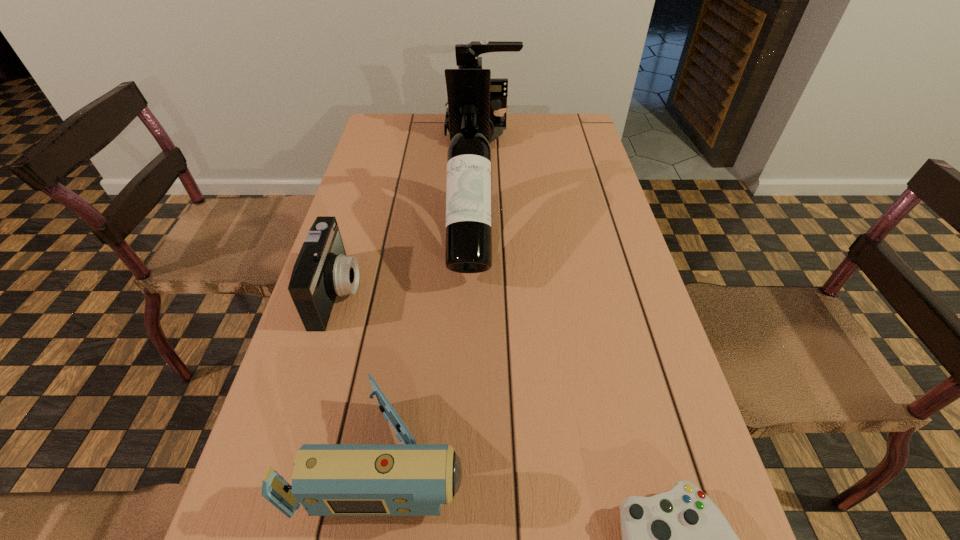
At what (x,y) coordinates should I click in order to perform the action: click on unoccupied area between the wine bottle and the second farthest camcorder. Please return your answer as a coordinate pair (x, y). This screenshot has width=960, height=540. Looking at the image, I should click on (404, 264).

What are the coordinates of `free spot between the nearest camcorder and the tallest object` in the screenshot? It's located at (428, 347).

Find the location of a particular element. The width and height of the screenshot is (960, 540). empty location between the nearest camcorder and the wine bottle is located at coordinates (428, 347).

The height and width of the screenshot is (540, 960). In order to click on blank region between the nearest camcorder and the second farthest camcorder in this screenshot , I will do `click(361, 375)`.

Select which object is the closest to the tallest camcorder. Please provide its 2D coordinates. Your answer should be formatted as a tuple, i.e. [(x, y)], where the tuple contains the x and y coordinates of a point satisfying the conditions above.

[(468, 242)]

I want to click on object that stands as the second closest to the second nearest camcorder, so click(x=468, y=242).

Select which camcorder appears as the third closest to the tallest object. Please provide its 2D coordinates. Your answer should be formatted as a tuple, i.e. [(x, y)], where the tuple contains the x and y coordinates of a point satisfying the conditions above.

[(409, 479)]

At what (x,y) coordinates should I click in order to perform the action: click on camcorder identified as the third closest to the tallest object. Please return your answer as a coordinate pair (x, y). Looking at the image, I should click on (409, 479).

In order to click on vacant space that satisfies the following two spatial constraints: 1. on the stand of the tallest object; 2. on the lens of the second farthest camcorder in this screenshot , I will do `click(469, 292)`.

Locate an element on the screen. The height and width of the screenshot is (540, 960). free space that satisfies the following two spatial constraints: 1. on the stand of the wine bottle; 2. on the side of the nearest camcorder with the flip-out screen is located at coordinates (466, 457).